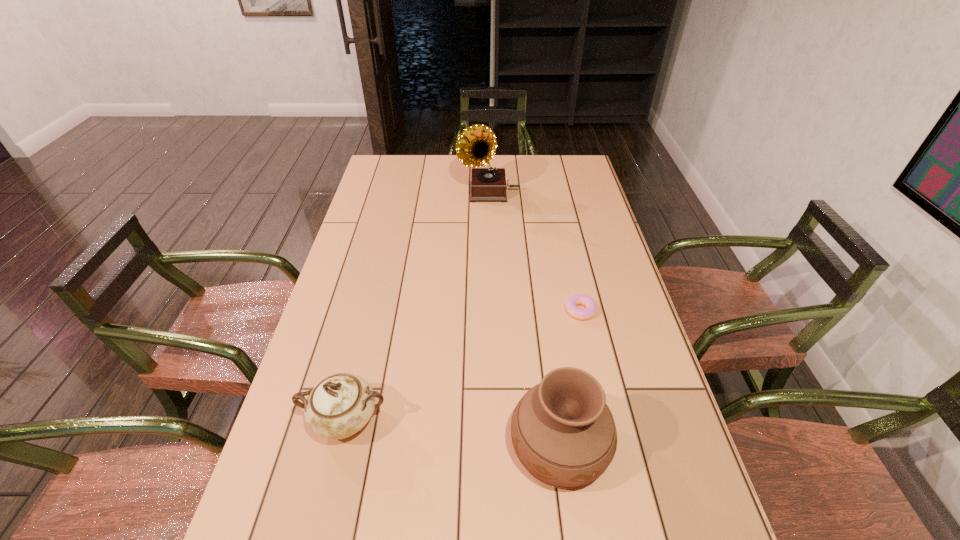
Locate an element on the screen. the tallest object is located at coordinates (476, 145).

Locate an element on the screen. This screenshot has width=960, height=540. phonograph record is located at coordinates (476, 145).

Locate an element on the screen. The width and height of the screenshot is (960, 540). urn is located at coordinates (563, 432).

Where is `the third tallest object`? the third tallest object is located at coordinates (340, 405).

At what (x,y) coordinates should I click in order to perform the action: click on the leftmost object. Please return your answer as a coordinate pair (x, y). This screenshot has width=960, height=540. Looking at the image, I should click on (340, 405).

Find the location of a particular element. This screenshot has width=960, height=540. the third nearest object is located at coordinates (579, 299).

The image size is (960, 540). I want to click on the shortest object, so click(579, 299).

Find the location of a particular element. The image size is (960, 540). vacant space located from the horn of the phonograph record is located at coordinates (408, 192).

In order to click on vacant position located from the horn of the phonograph record in this screenshot , I will do `click(419, 192)`.

Identify the location of free region located from the horn of the phonograph record. (393, 192).